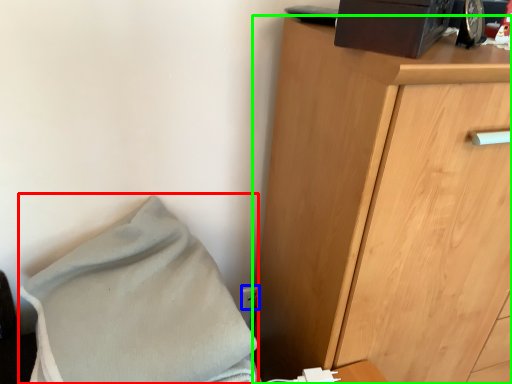
Question: Which object is positioned farthest from blanket (highlighted by a red box)? Select from electric outlet (highlighted by a blue box) and chest of drawers (highlighted by a green box).

Choices:
 (A) electric outlet
 (B) chest of drawers

Answer: (A)